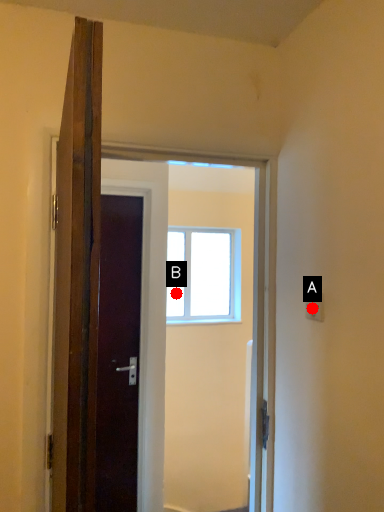
Question: Two points are circled on the image, labeled by A and B beside each circle. Which point appears farthest from the camera in this image?

Choices:
 (A) A is further
 (B) B is further

Answer: (B)